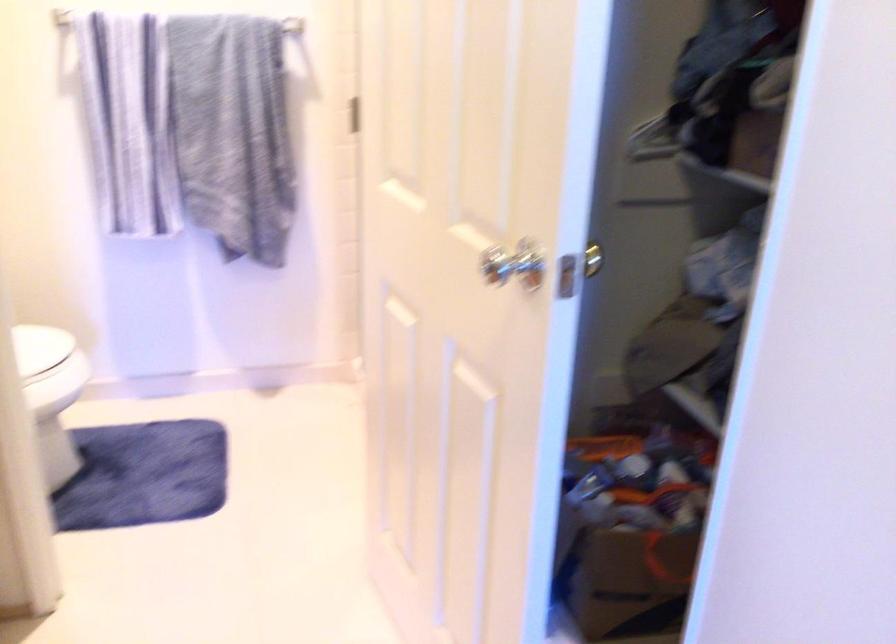
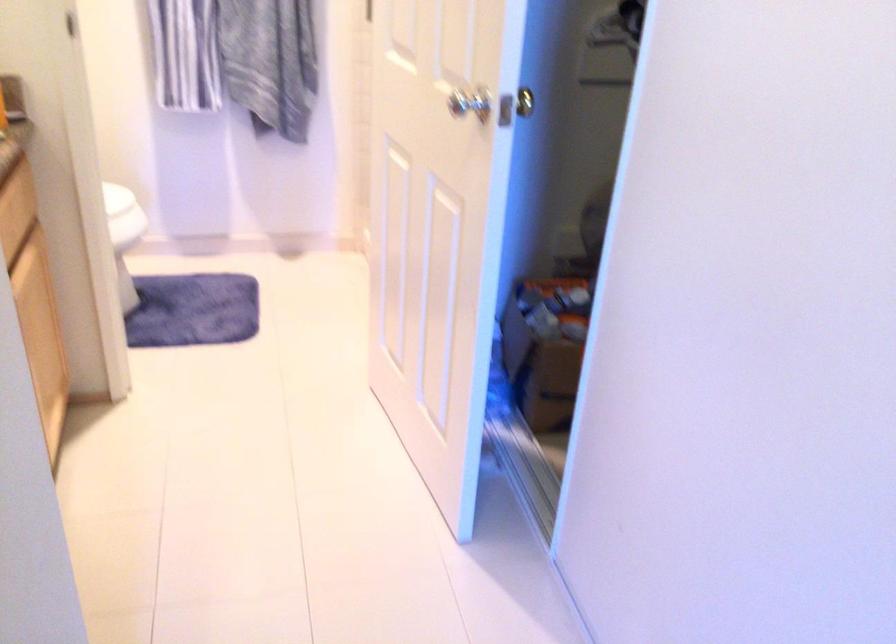
Question: The images are taken continuously from a first-person perspective. In which direction is your viewpoint rotating?

Choices:
 (A) Left
 (B) Right
 (C) Up
 (D) Down

Answer: (D)